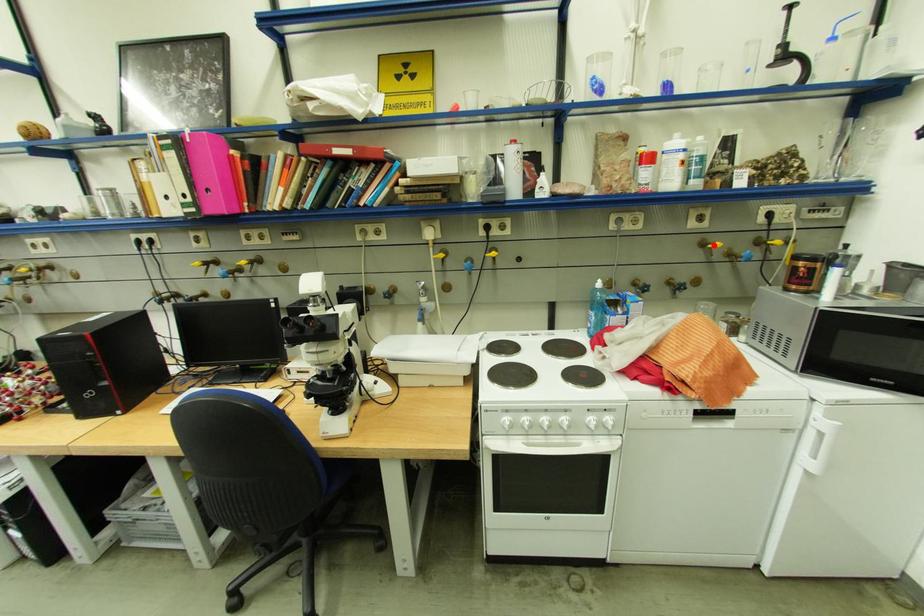
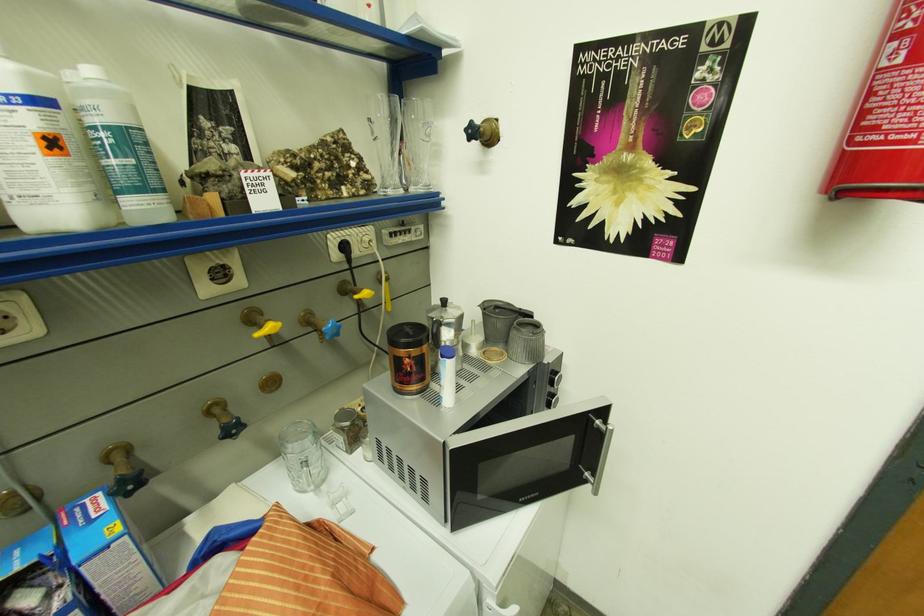
Locate, in the second image, the point that corresponds to the highlighted location in the first image.

(262, 322)